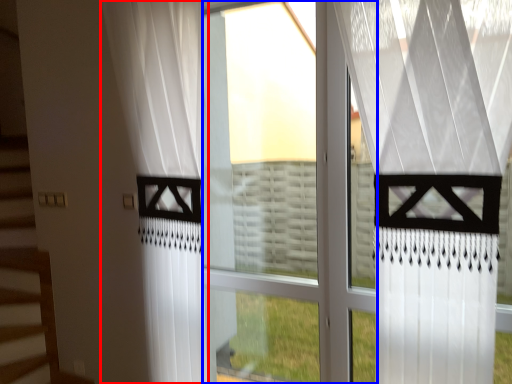
Question: Which of the following is the closest to the observer, curtain (highlighted by a red box) or glass window (highlighted by a blue box)?

Choices:
 (A) curtain
 (B) glass window

Answer: (A)